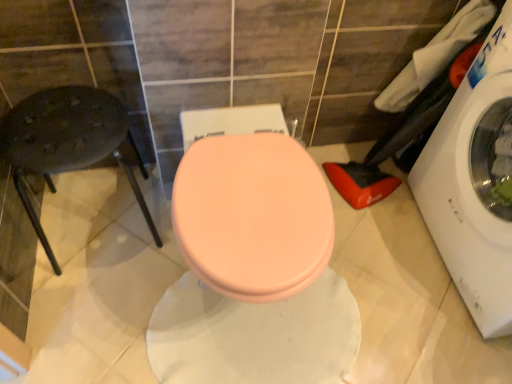
Question: From the image's perspective, would you say white fabric at upper right, placed as the 1th laundry when sorted from left to right, is shown under white fabric laundry at right, the 2th laundry from the left?

Choices:
 (A) yes
 (B) no

Answer: (B)

Question: Is white fabric at upper right, acting as the second laundry starting from the right, touching white fabric laundry at right, arranged as the first laundry when viewed from the right?

Choices:
 (A) yes
 (B) no

Answer: (B)

Question: Is white fabric at upper right, placed as the 1th laundry when sorted from left to right, wider than white fabric laundry at right, arranged as the first laundry when viewed from the right?

Choices:
 (A) yes
 (B) no

Answer: (B)

Question: Is white fabric at upper right, placed as the 1th laundry when sorted from left to right, smaller than white fabric laundry at right, the 2th laundry from the left?

Choices:
 (A) no
 (B) yes

Answer: (B)

Question: Is white fabric at upper right, placed as the 1th laundry when sorted from left to right, outside of white fabric laundry at right, arranged as the first laundry when viewed from the right?

Choices:
 (A) no
 (B) yes

Answer: (A)

Question: In terms of height, does white glossy washing machine at right look taller or shorter compared to metallic black stool at left?

Choices:
 (A) tall
 (B) short

Answer: (A)

Question: Looking at the image, does white glossy washing machine at right seem bigger or smaller compared to metallic black stool at left?

Choices:
 (A) small
 (B) big

Answer: (B)

Question: In the image, is white glossy washing machine at right positioned in front of or behind metallic black stool at left?

Choices:
 (A) front
 (B) behind

Answer: (A)

Question: From a real-world perspective, is white glossy washing machine at right physically located above or below metallic black stool at left?

Choices:
 (A) below
 (B) above

Answer: (B)

Question: In the image, is matte pink toilet seat at center positioned in front of or behind white glossy washing machine at right?

Choices:
 (A) front
 (B) behind

Answer: (B)

Question: In terms of width, does matte pink toilet seat at center look wider or thinner when compared to white glossy washing machine at right?

Choices:
 (A) wide
 (B) thin

Answer: (A)

Question: Is matte pink toilet seat at center bigger or smaller than white glossy washing machine at right?

Choices:
 (A) small
 (B) big

Answer: (A)

Question: Is matte pink toilet seat at center situated inside white glossy washing machine at right or outside?

Choices:
 (A) outside
 (B) inside

Answer: (A)

Question: Is point (144, 211) positioned closer to the camera than point (434, 59)?

Choices:
 (A) farther
 (B) closer

Answer: (A)

Question: Is metallic black stool at left to the left or to the right of white fabric at upper right, acting as the second laundry starting from the right, in the image?

Choices:
 (A) right
 (B) left

Answer: (B)